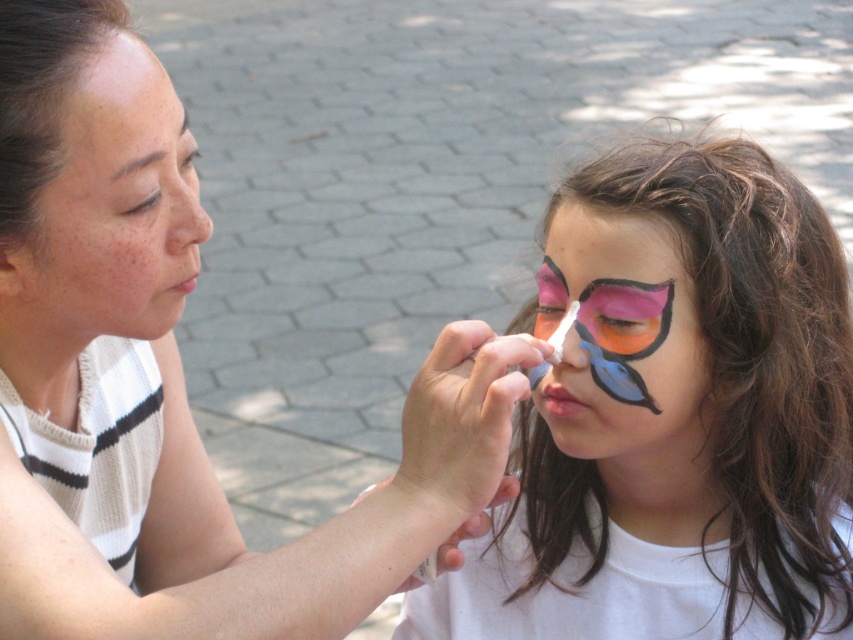
Where is `matte blue nose at center`? Image resolution: width=853 pixels, height=640 pixels. matte blue nose at center is located at coordinates (573, 342).

Find the location of a particular element. This screenshot has height=640, width=853. matte blue nose at center is located at coordinates (573, 342).

Can you confirm if matte white shirt at center is thinner than matte blue nose at center?

No.

Based on the photo, is matte white shirt at center bigger than matte blue nose at center?

Indeed, matte white shirt at center has a larger size compared to matte blue nose at center.

I want to click on matte white shirt at center, so point(180,376).

In the scene shown: Can you confirm if matte pink paint at center is taller than brown smooth eyebrow at upper left?

Indeed, matte pink paint at center has a greater height compared to brown smooth eyebrow at upper left.

Which is behind, point (653, 445) or point (113, 179)?

Point (653, 445)

Based on the photo, who is more distant from viewer, (x=624, y=448) or (x=119, y=166)?

The point (x=624, y=448) is behind.

Locate an element on the screen. The height and width of the screenshot is (640, 853). matte pink paint at center is located at coordinates (624, 342).